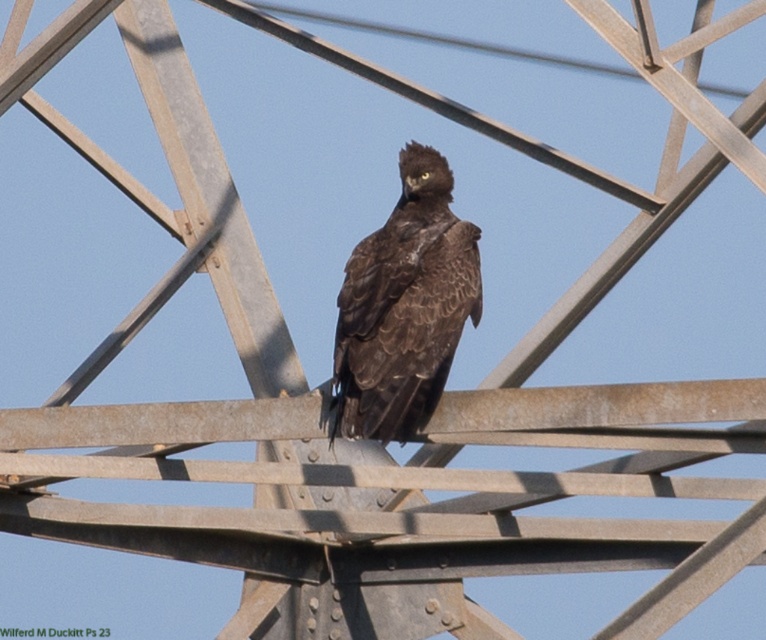
Which is more to the right, brown feathered eagle at center or brushed metal power line at upper center?

brushed metal power line at upper center is more to the right.

What do you see at coordinates (404, 307) in the screenshot? The width and height of the screenshot is (766, 640). I see `brown feathered eagle at center` at bounding box center [404, 307].

Where is `brown feathered eagle at center`? The image size is (766, 640). brown feathered eagle at center is located at coordinates (404, 307).